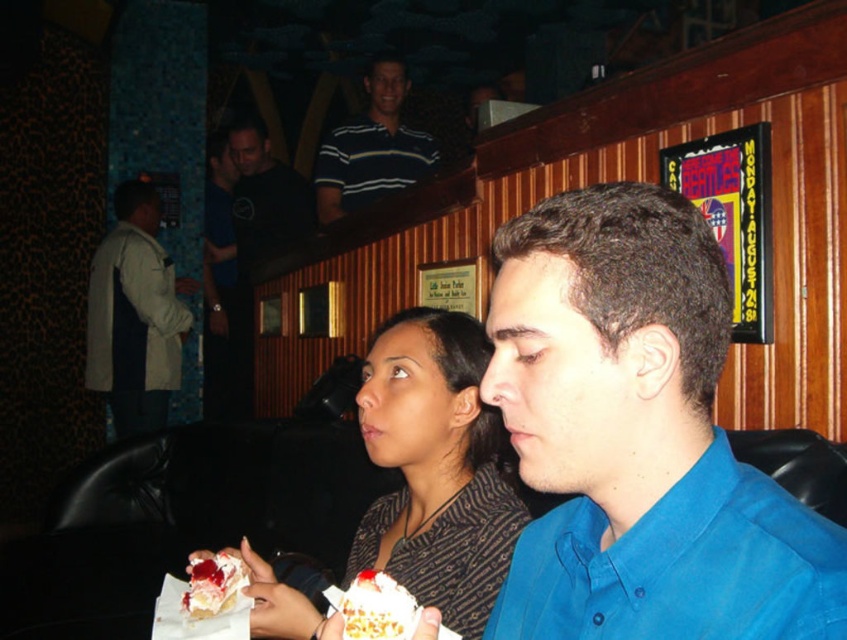
Does striped polo shirt at upper center appear on the left side of black cotton shirt at upper center?

Incorrect, striped polo shirt at upper center is not on the left side of black cotton shirt at upper center.

Locate an element on the screen. striped polo shirt at upper center is located at coordinates (372, 147).

Is blue cotton shirt at center shorter than white frosted cake at center?

In fact, blue cotton shirt at center may be taller than white frosted cake at center.

Can you confirm if blue cotton shirt at center is positioned above white frosted cake at center?

Yes, blue cotton shirt at center is above white frosted cake at center.

Locate an element on the screen. The height and width of the screenshot is (640, 847). blue cotton shirt at center is located at coordinates (638, 436).

Is matte brown dress at center positioned in front of white frosted cake at center?

No.

Between matte brown dress at center and white frosted cake at center, which one appears on the right side from the viewer's perspective?

matte brown dress at center is more to the right.

Who is more distant from viewer, (464, 449) or (347, 609)?

Point (464, 449)

Find the location of a particular element. The height and width of the screenshot is (640, 847). matte brown dress at center is located at coordinates (435, 467).